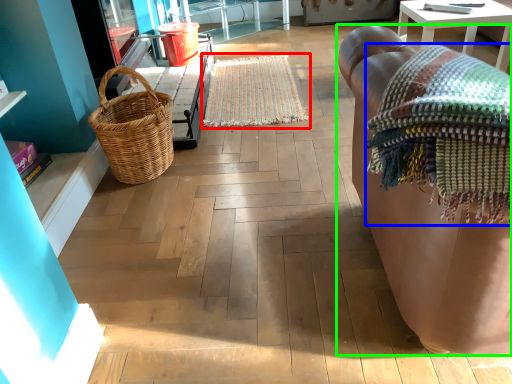
Question: Estimate the real-world distances between objects in this image. Which object is farther from mat (highlighted by a red box), blanket (highlighted by a blue box) or studio couch (highlighted by a green box)?

Choices:
 (A) blanket
 (B) studio couch

Answer: (A)